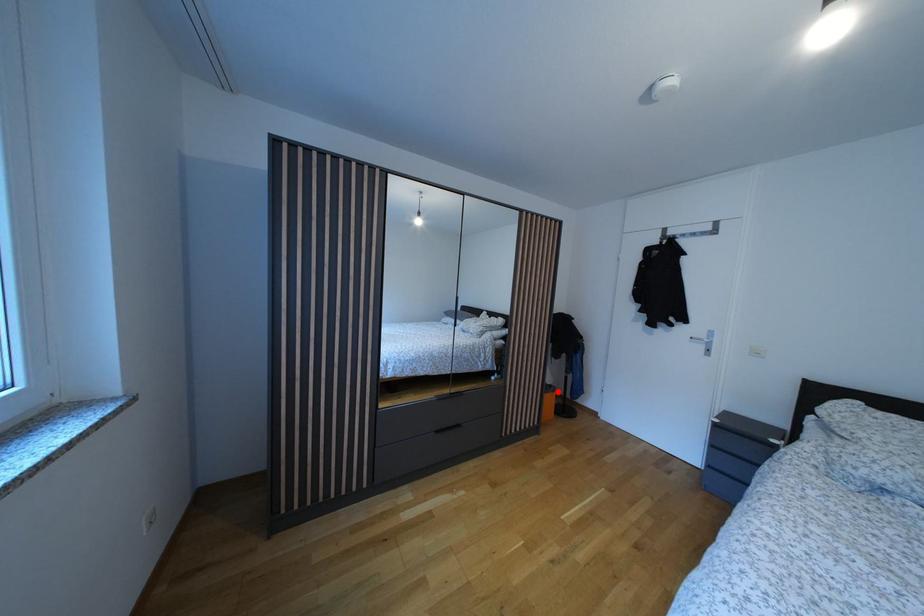
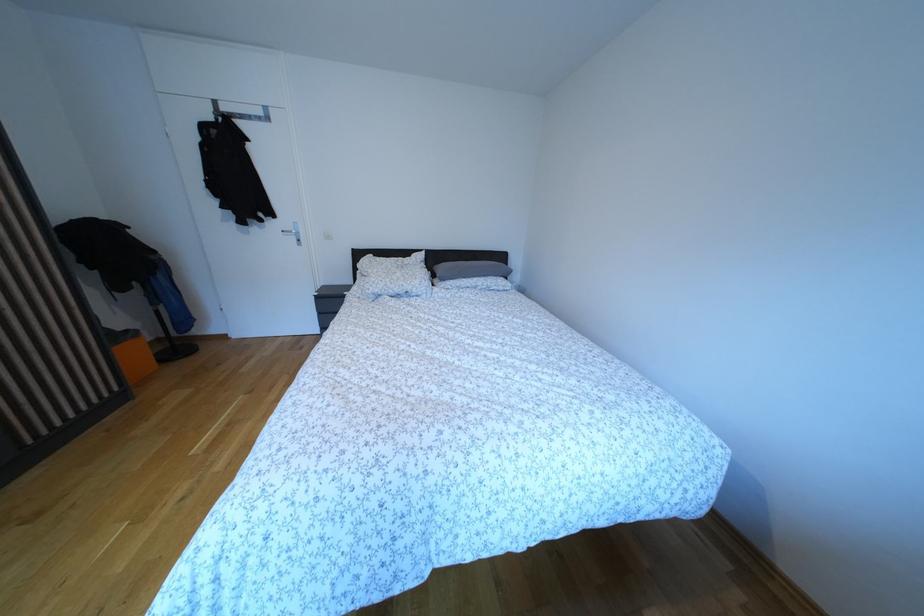
In the second image, find the point that corresponds to the highlighted location in the first image.

(134, 338)